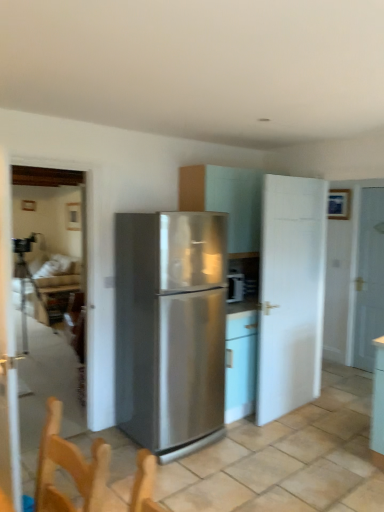
Question: From the image's perspective, is matte white cabinet at center beneath clear glass door at left, the 1th glass door viewed from the back?

Choices:
 (A) no
 (B) yes

Answer: (A)

Question: Is matte white cabinet at center located outside clear glass door at left, the 1th glass door viewed from the back?

Choices:
 (A) yes
 (B) no

Answer: (A)

Question: Considering the relative sizes of matte white cabinet at center and clear glass door at left, the 1th glass door viewed from the back, in the image provided, is matte white cabinet at center smaller than clear glass door at left, the 1th glass door viewed from the back,?

Choices:
 (A) no
 (B) yes

Answer: (A)

Question: Is matte white cabinet at center to the left of clear glass door at left, the 1th glass door viewed from the back, from the viewer's perspective?

Choices:
 (A) no
 (B) yes

Answer: (A)

Question: Is matte white cabinet at center at the right side of clear glass door at left, the 1th glass door viewed from the back?

Choices:
 (A) no
 (B) yes

Answer: (B)

Question: From the image's perspective, is matte white cabinet at center over clear glass door at left, the 1th glass door viewed from the back?

Choices:
 (A) no
 (B) yes

Answer: (B)

Question: From the image's perspective, does clear glass door at left, which ranks as the 2th glass door in front-to-back order, appear higher than white matte door at center-right, placed as the first door when sorted from left to right?

Choices:
 (A) yes
 (B) no

Answer: (A)

Question: From a real-world perspective, is clear glass door at left, the 1th glass door viewed from the back, physically below white matte door at center-right, placed as the first door when sorted from left to right?

Choices:
 (A) yes
 (B) no

Answer: (B)

Question: Would you say white matte door at center-right, acting as the 1th door starting from the front, is part of clear glass door at left, which ranks as the 2th glass door in front-to-back order,'s contents?

Choices:
 (A) no
 (B) yes

Answer: (A)

Question: Is clear glass door at left, the 1th glass door viewed from the back, in front of white matte door at center-right, which is counted as the second door, starting from the back?

Choices:
 (A) yes
 (B) no

Answer: (A)

Question: Considering the relative sizes of clear glass door at left, the 1th glass door viewed from the back, and white matte door at center-right, placed as the first door when sorted from left to right, in the image provided, is clear glass door at left, the 1th glass door viewed from the back, taller than white matte door at center-right, placed as the first door when sorted from left to right,?

Choices:
 (A) yes
 (B) no

Answer: (A)

Question: Can you confirm if clear glass door at left, the 1th glass door viewed from the back, is bigger than white matte door at center-right, which is counted as the second door, starting from the back?

Choices:
 (A) yes
 (B) no

Answer: (B)

Question: Can you confirm if stainless steel refrigerator at center is thinner than wooden table at lower left?

Choices:
 (A) yes
 (B) no

Answer: (B)